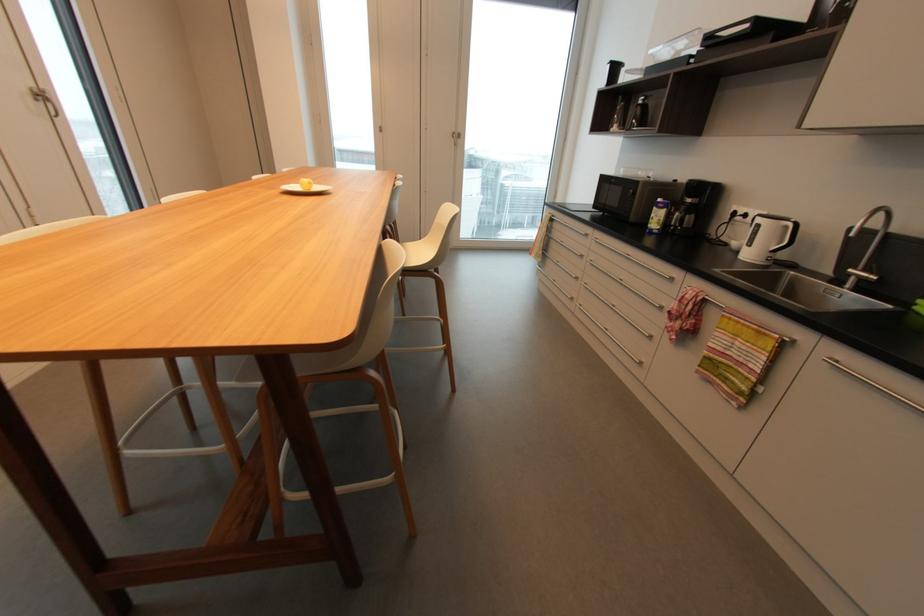
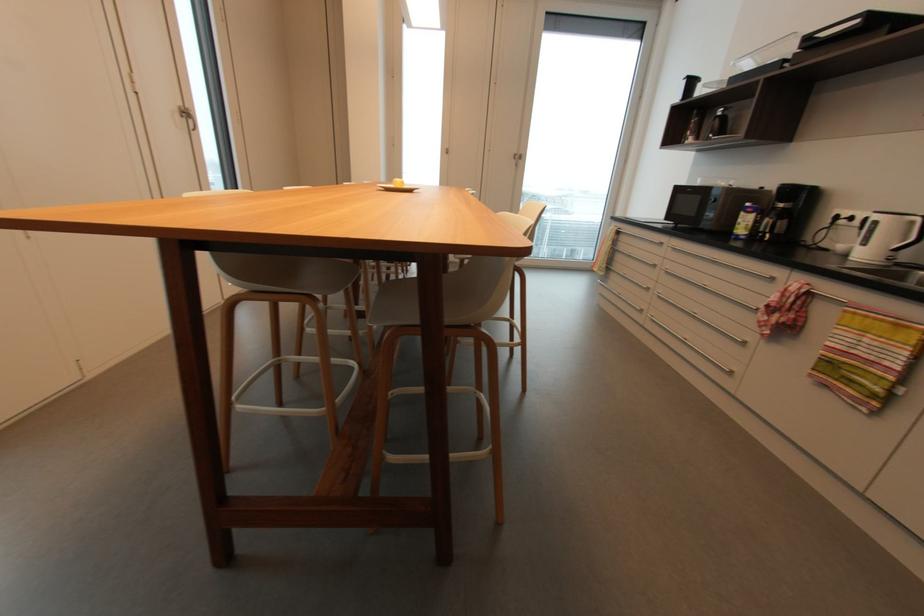
Where in the second image is the point corresponding to [663,200] from the first image?

(750, 205)